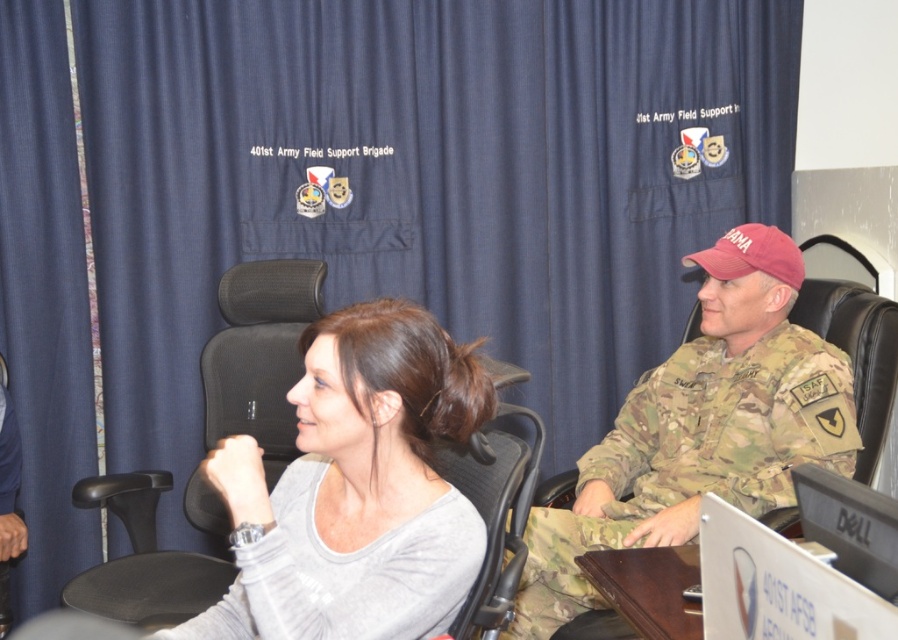
Question: Is brown wood table at lower center behind camouflage fabric uniform at center?

Choices:
 (A) yes
 (B) no

Answer: (B)

Question: Among these points, which one is nearest to the camera?

Choices:
 (A) (612, 588)
 (B) (10, 509)

Answer: (A)

Question: Does black mesh chair at center lie in front of camouflage fabric uniform at center?

Choices:
 (A) yes
 (B) no

Answer: (A)

Question: Is camouflage uniform at right to the right of black mesh swivel chair at left from the viewer's perspective?

Choices:
 (A) no
 (B) yes

Answer: (B)

Question: Which point is farther to the camera?

Choices:
 (A) camouflage uniform at right
 (B) black mesh swivel chair at left
 (C) camouflage fabric uniform at center
 (D) gray matte shirt at center

Answer: (C)

Question: Which of the following is the closest to the observer?

Choices:
 (A) (283, 419)
 (B) (682, 556)
 (C) (0, 408)

Answer: (B)